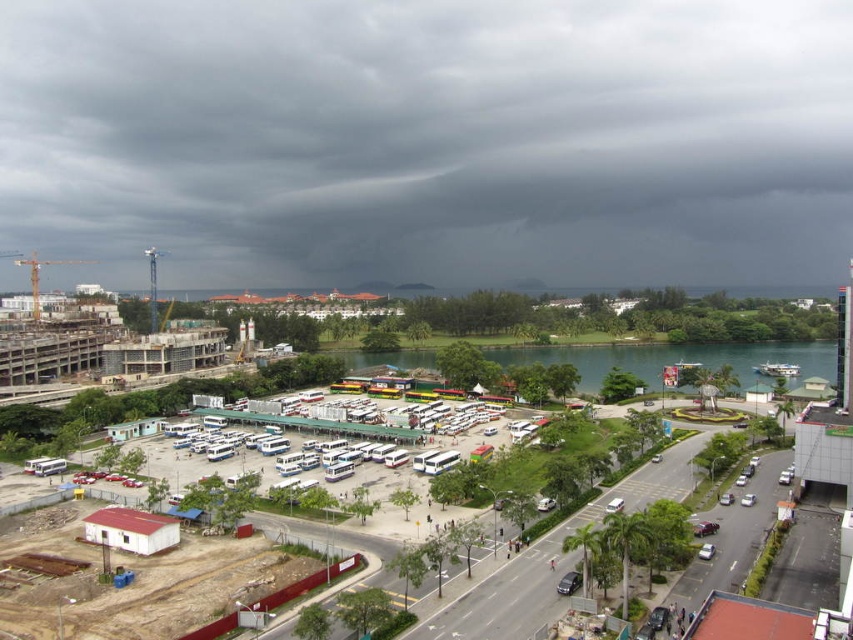
Between dark gray cloud at upper center and concrete construction site at center, which one appears on the right side from the viewer's perspective?

concrete construction site at center

Can you confirm if dark gray cloud at upper center is bigger than concrete construction site at center?

Indeed, dark gray cloud at upper center has a larger size compared to concrete construction site at center.

Who is more forward, (845, 220) or (323, 428)?

Point (323, 428) is more forward.

Identify the location of dark gray cloud at upper center. (428, 140).